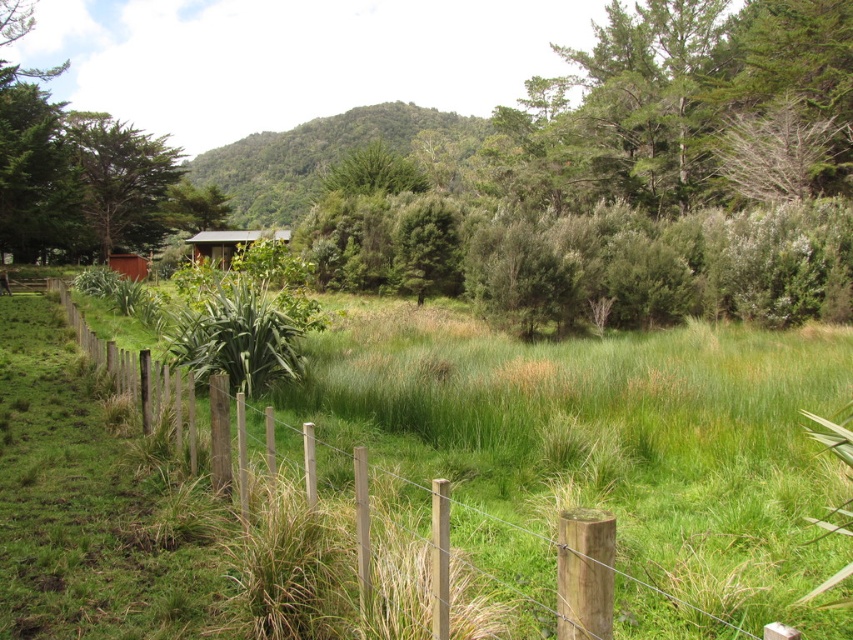
Which is behind, point (120, 157) or point (122, 262)?

The point (120, 157) is more distant.

Image resolution: width=853 pixels, height=640 pixels. I want to click on green textured tree at upper left, so click(120, 179).

Is green leafy tree at upper left further to camera compared to wooden hut at center?

No, it is in front of wooden hut at center.

Does green leafy tree at upper left appear on the right side of wooden hut at center?

Incorrect, green leafy tree at upper left is not on the right side of wooden hut at center.

What do you see at coordinates (76, 173) in the screenshot? Image resolution: width=853 pixels, height=640 pixels. I see `green leafy tree at upper left` at bounding box center [76, 173].

In order to click on green leafy tree at upper left in this screenshot , I will do click(76, 173).

Who is shorter, green leafy shrub at center or green leafy tree at upper left?

With less height is green leafy shrub at center.

Does green leafy shrub at center appear on the right side of green leafy tree at upper left?

Answer: Yes, green leafy shrub at center is to the right of green leafy tree at upper left.

The height and width of the screenshot is (640, 853). Describe the element at coordinates (631, 179) in the screenshot. I see `green leafy shrub at center` at that location.

You are a GUI agent. You are given a task and a screenshot of the screen. Output one action in this format:
    pyautogui.click(x=<x>, y=<y>)
    Task: Click on the green leafy shrub at center
    
    Given the screenshot: What is the action you would take?
    pyautogui.click(x=631, y=179)